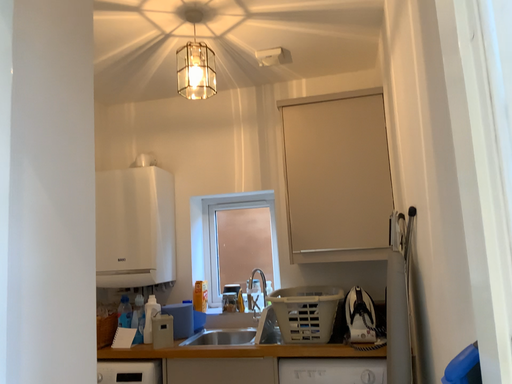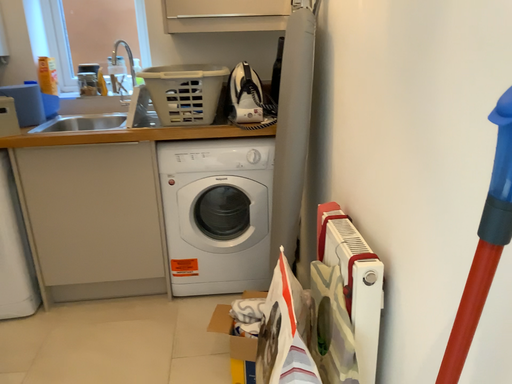
Question: How did the camera likely rotate when shooting the video?

Choices:
 (A) rotated right
 (B) rotated left

Answer: (A)